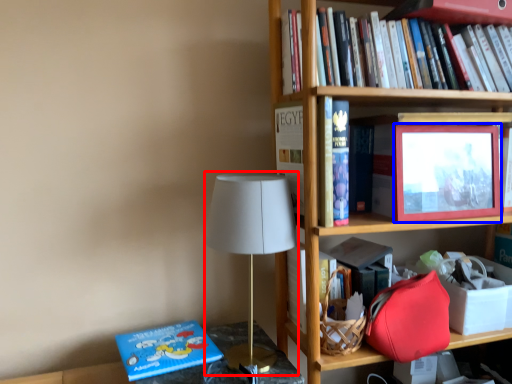
Question: Which of the following is the farthest to the observer, table lamp (highlighted by a red box) or picture frame (highlighted by a blue box)?

Choices:
 (A) table lamp
 (B) picture frame

Answer: (B)